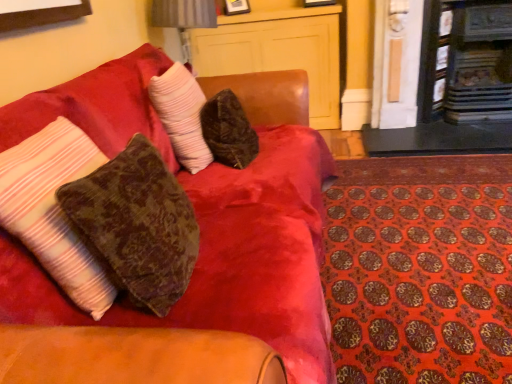
Question: Looking at the image, does orange patterned mat at lower right seem bigger or smaller compared to metallic silver table lamp at upper center?

Choices:
 (A) big
 (B) small

Answer: (A)

Question: Based on their positions, is orange patterned mat at lower right located to the left or right of metallic silver table lamp at upper center?

Choices:
 (A) right
 (B) left

Answer: (A)

Question: Which is nearer to the velvet brown pillow at left, which is the first pillow in front-to-back order?

Choices:
 (A) orange patterned mat at lower right
 (B) dark wood fireplace at upper right, the second fireplace from the right
 (C) velvet-like brown couch at upper left
 (D) black metal fireplace at upper right, the first fireplace when ordered from right to left
 (E) ruffled white pillow at center, which appears as the 3th pillow when viewed from the front

Answer: (C)

Question: Which is farther from the velvet-like brown couch at upper left?

Choices:
 (A) velvet brown pillow at center, the 2th pillow from the front
 (B) velvet brown pillow at left, which is the first pillow in front-to-back order
 (C) orange patterned mat at lower right
 (D) matte wood dresser at upper center
 (E) black metal fireplace at upper right, the first fireplace when ordered from right to left

Answer: (E)